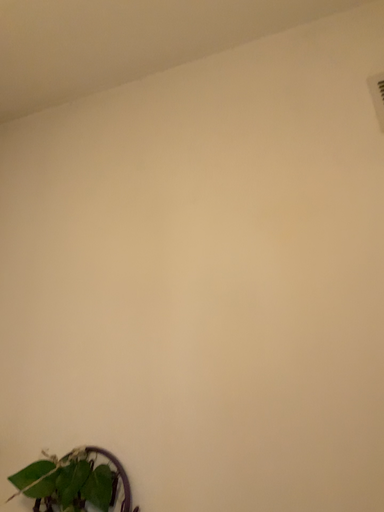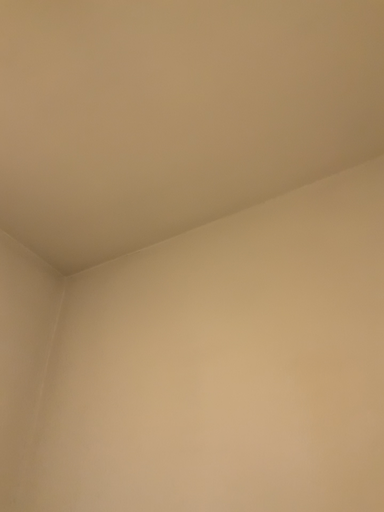
Question: Which way did the camera rotate in the video?

Choices:
 (A) rotated left
 (B) rotated right

Answer: (A)